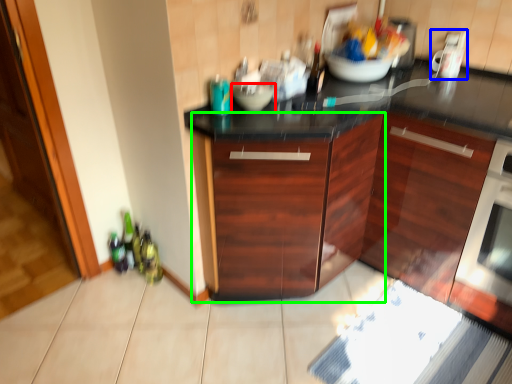
Question: Which is farther away from bowl (highlighted by a red box)? appliance (highlighted by a blue box) or cabinetry (highlighted by a green box)?

Choices:
 (A) appliance
 (B) cabinetry

Answer: (A)